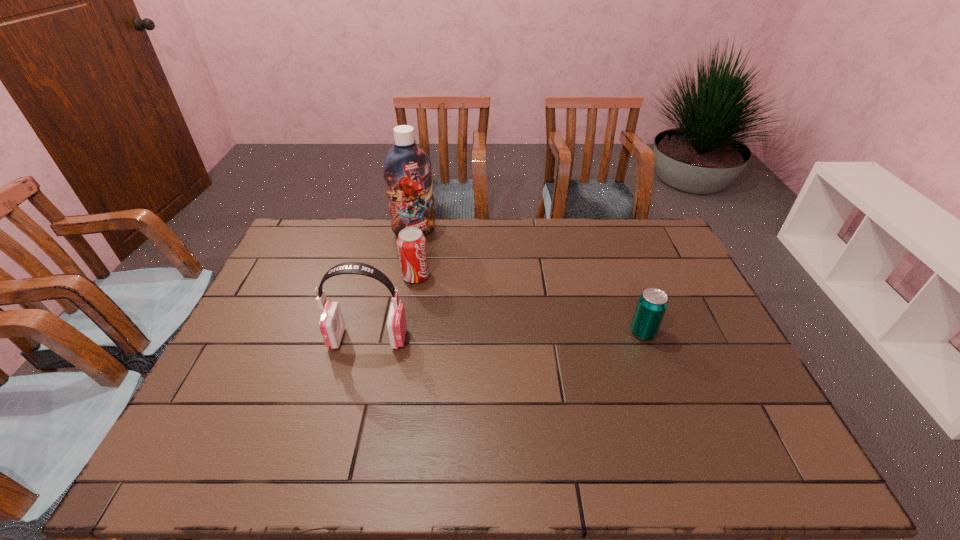
Where is `the second tallest object`? The height and width of the screenshot is (540, 960). the second tallest object is located at coordinates (331, 324).

Where is `the shortest object`? Image resolution: width=960 pixels, height=540 pixels. the shortest object is located at coordinates (652, 304).

You are a GUI agent. You are given a task and a screenshot of the screen. Output one action in this format:
    pyautogui.click(x=<x>, y=<y>)
    Task: Click on the beer can
    This screenshot has height=540, width=960.
    Given the screenshot: What is the action you would take?
    pyautogui.click(x=652, y=304)

Where is `the farthest object`? the farthest object is located at coordinates (407, 168).

Find the location of a particular element. The width and height of the screenshot is (960, 540). shampoo is located at coordinates (407, 168).

The height and width of the screenshot is (540, 960). What are the coordinates of `the third tallest object` in the screenshot? It's located at (411, 243).

Where is `the second farthest object`? This screenshot has width=960, height=540. the second farthest object is located at coordinates (411, 243).

Image resolution: width=960 pixels, height=540 pixels. Identify the location of vacant space situated on the outer surface of the second tallest object. (271, 339).

Find the location of a particular element. This screenshot has height=540, width=960. free space located 0.150m on the outer surface of the second tallest object is located at coordinates (277, 339).

Where is `free space located on the outer surface of the second tallest object`? This screenshot has width=960, height=540. free space located on the outer surface of the second tallest object is located at coordinates (267, 339).